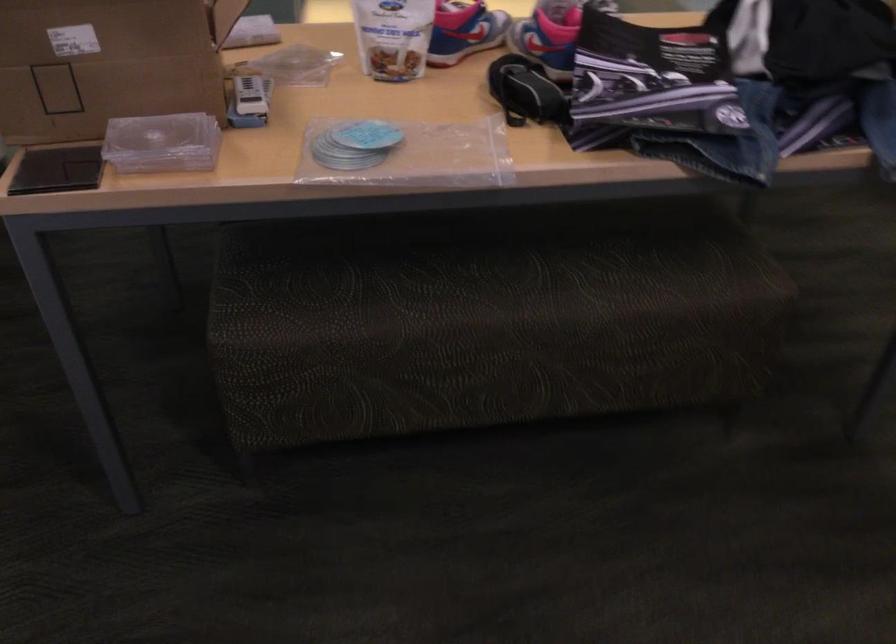
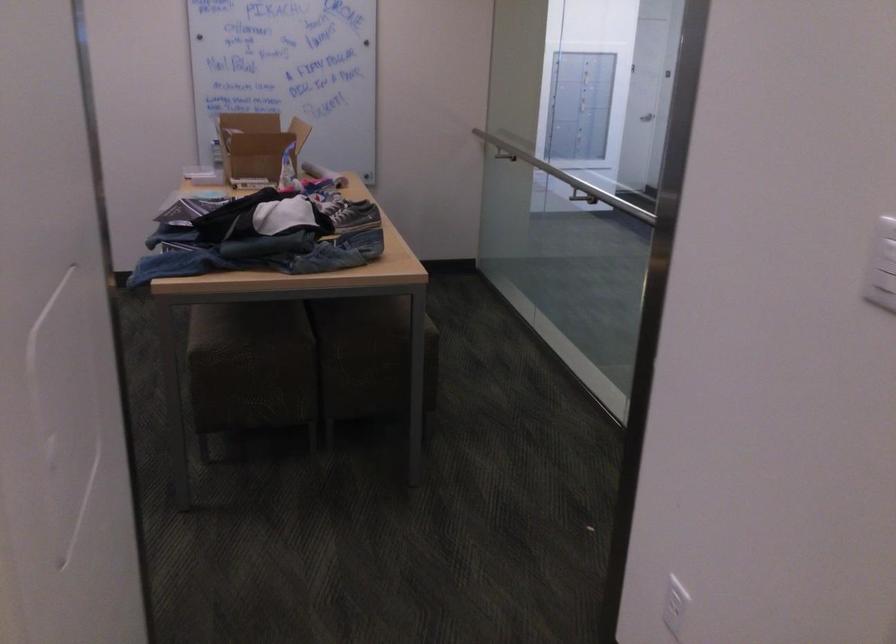
Question: I am providing you with two images of the same scene from different viewpoints. Please identify which objects are invisible in image2.

Choices:
 (A) upholstered chair sitting surface
 (B) metal handrail
 (C) cardboard box
 (D) stool sitting surface

Answer: (C)